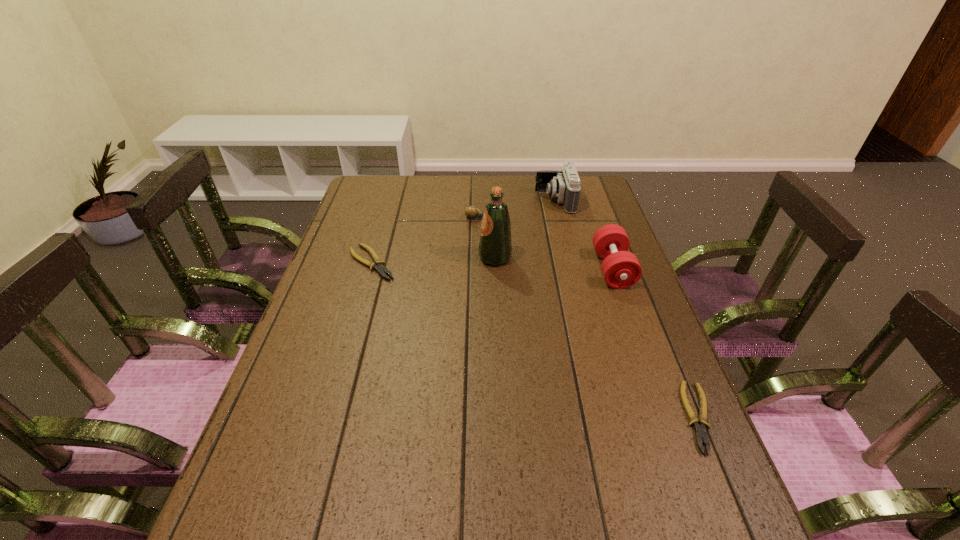
This screenshot has width=960, height=540. Identify the location of the taller pliers. (378, 265).

What are the coordinates of `the farther pliers` in the screenshot? It's located at (378, 265).

What are the coordinates of `the nearest object` in the screenshot? It's located at (700, 430).

The image size is (960, 540). Find the location of `the nearer pliers`. the nearer pliers is located at coordinates (700, 430).

The height and width of the screenshot is (540, 960). Identify the location of the second tallest object. pos(564,185).

The width and height of the screenshot is (960, 540). Find the location of `the fourth object from left to right`. the fourth object from left to right is located at coordinates (564, 185).

I want to click on escargot, so click(471, 212).

The height and width of the screenshot is (540, 960). I want to click on dumbbell, so click(621, 269).

Where is `the tallest object`? The image size is (960, 540). the tallest object is located at coordinates tap(495, 248).

Where is `blank space located on the back of the leftmost object`? blank space located on the back of the leftmost object is located at coordinates (387, 210).